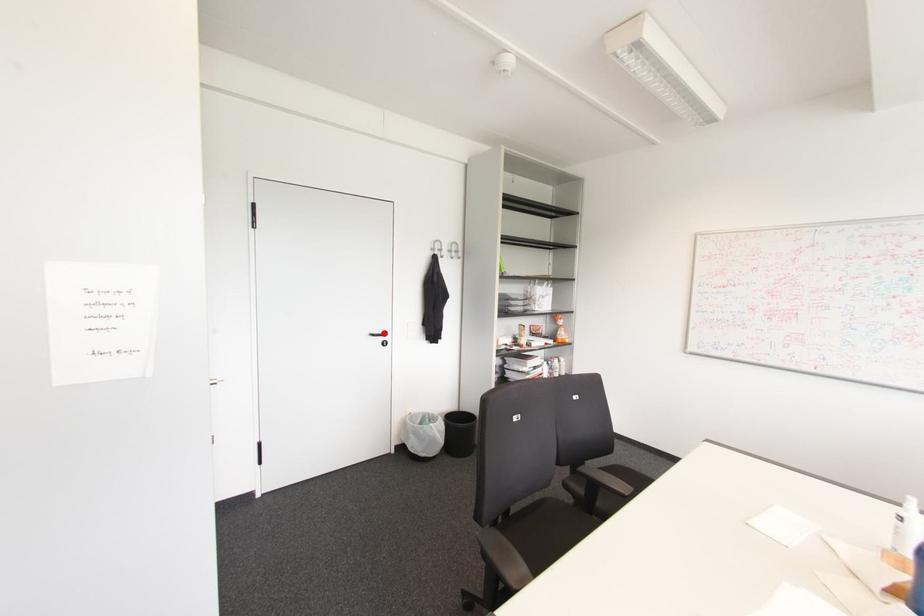
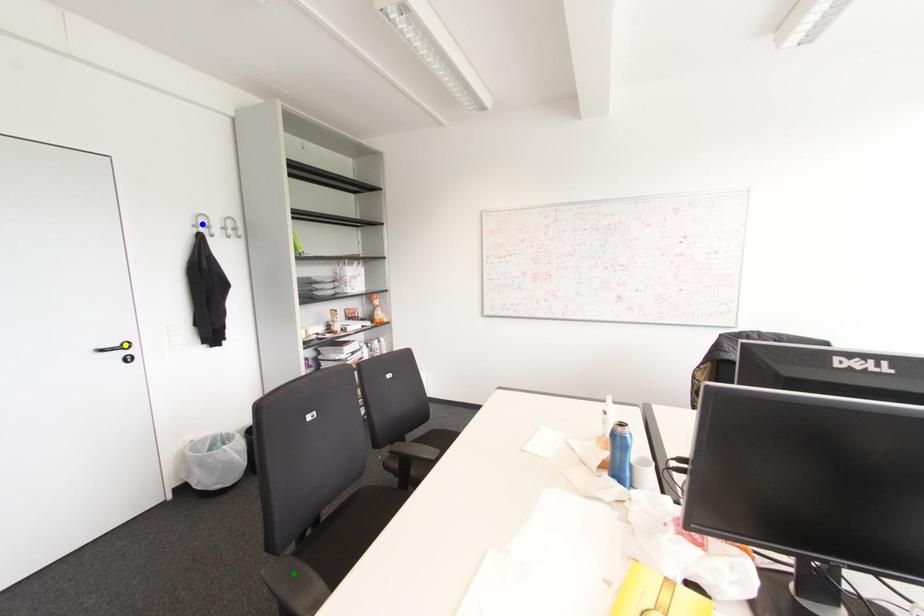
Question: I am providing you with two images of the same scene from different viewpoints. A red point is marked on the first image. You are given multiple points on the second image. Can you choose the point in image 2 that corresponds to the point in image 1?

Choices:
 (A) green point
 (B) yellow point
 (C) blue point

Answer: (B)